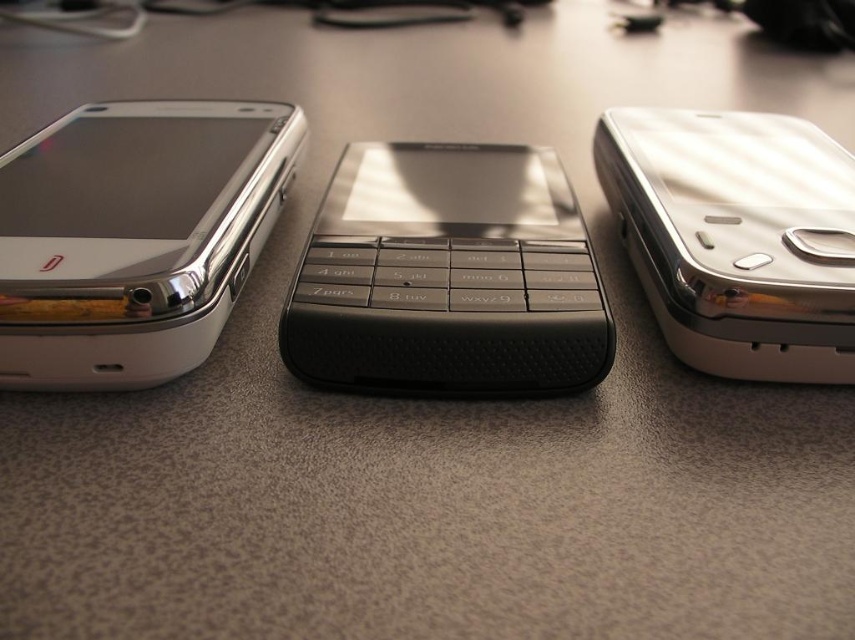
Question: Observing the image, what is the correct spatial positioning of black textured keypad at center in reference to metallic silver phone at right?

Choices:
 (A) below
 (B) above

Answer: (A)

Question: Considering the real-world distances, which object is closest to the black textured keypad at center?

Choices:
 (A) metallic silver phone at right
 (B) matte silver smartphone at left

Answer: (A)

Question: Which of the following is the farthest from the observer?

Choices:
 (A) (364, 184)
 (B) (189, 244)

Answer: (A)

Question: Where is matte silver smartphone at left located in relation to metallic silver phone at right in the image?

Choices:
 (A) left
 (B) right

Answer: (A)

Question: Can you confirm if black textured keypad at center is bigger than matte silver smartphone at left?

Choices:
 (A) no
 (B) yes

Answer: (A)

Question: Which of the following is the closest to the observer?

Choices:
 (A) matte silver smartphone at left
 (B) black textured keypad at center

Answer: (A)